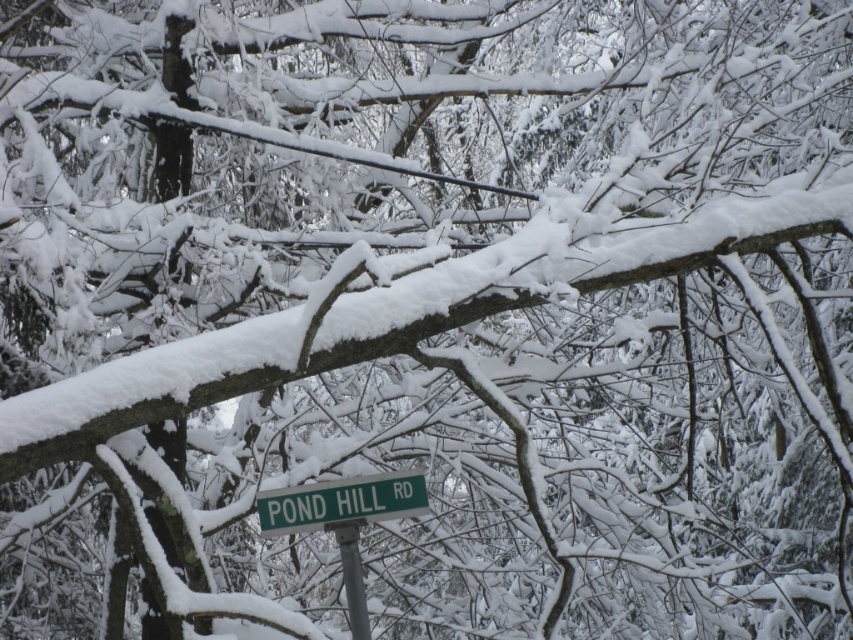
You are standing in the snow and looking at the green plastic street sign at center and the metallic gray pole at center. Which object is nearer to you?

The green plastic street sign at center is closer to the viewer than the metallic gray pole at center.